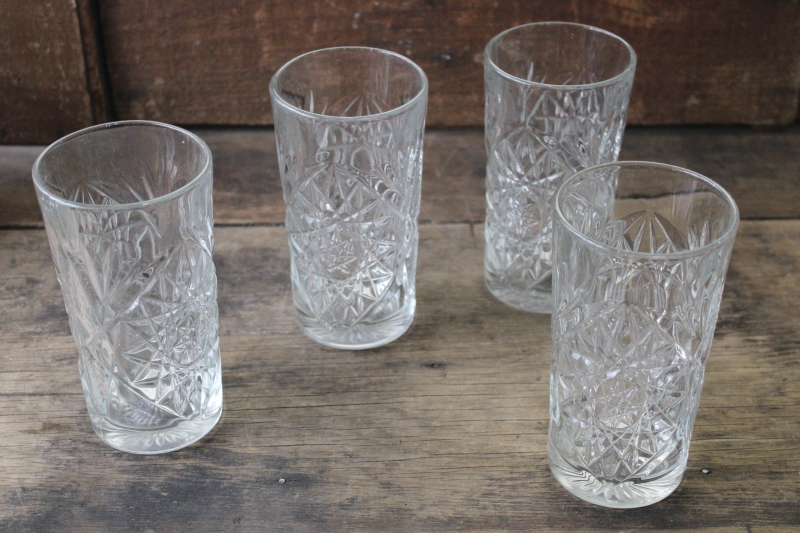
Locate an element on the screen. wall is located at coordinates (724, 72).